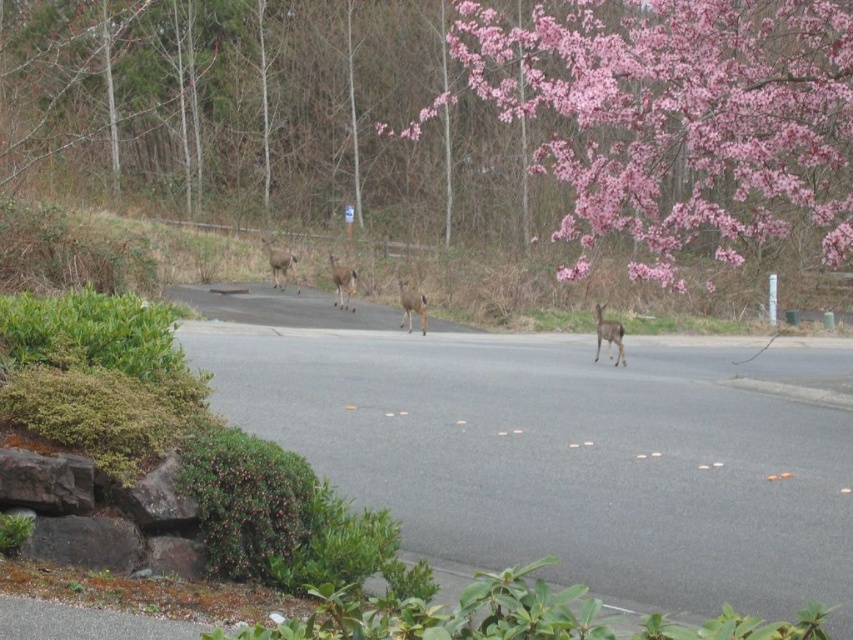
Question: Which point is farther to the camera?

Choices:
 (A) [700, 90]
 (B) [354, 269]
 (C) [614, 324]

Answer: (B)

Question: Is brown matte/deer at center to the left of brown matte deer at center from the viewer's perspective?

Choices:
 (A) no
 (B) yes

Answer: (B)

Question: Is brown matte/deer at center behind brown matte deer at center?

Choices:
 (A) yes
 (B) no

Answer: (A)

Question: Does pink blossom tree at upper right come in front of brown matte deer at center?

Choices:
 (A) no
 (B) yes

Answer: (B)

Question: Among these objects, which one is farthest from the camera?

Choices:
 (A) brown matte/deer at center
 (B) brown matte deer at center
 (C) brown fur deer at center

Answer: (C)

Question: Which is nearer to the brown matte/deer at center?

Choices:
 (A) pink blossom tree at upper right
 (B) brown furry deer at center
 (C) brown matte deer at center

Answer: (C)